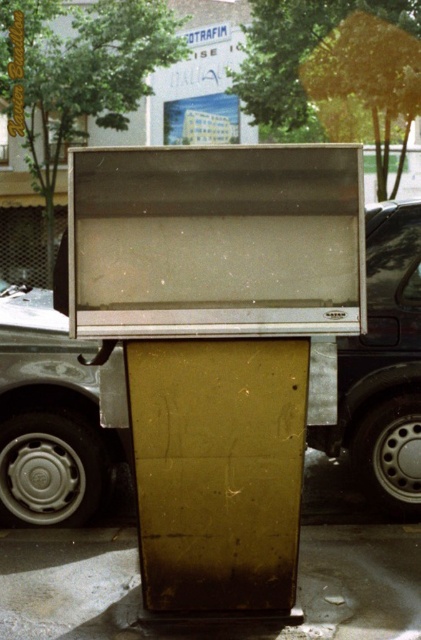
Which of these two, matte brown cardboard box at center or metallic silver car at center, stands taller?

With more height is metallic silver car at center.

Does matte brown cardboard box at center appear on the left side of metallic silver car at center?

Indeed, matte brown cardboard box at center is positioned on the left side of metallic silver car at center.

Find the location of a particular element. matte brown cardboard box at center is located at coordinates (218, 470).

Does matte brown cardboard box at center have a larger size compared to smooth concrete pavement at center?

Actually, matte brown cardboard box at center might be smaller than smooth concrete pavement at center.

Locate an element on the screen. The height and width of the screenshot is (640, 421). matte brown cardboard box at center is located at coordinates (218, 470).

Does metallic silver car at center have a smaller size compared to smooth concrete pavement at center?

Actually, metallic silver car at center might be larger than smooth concrete pavement at center.

Is point (53, 403) farther from viewer compared to point (349, 547)?

Yes.

Is point (373, 365) less distant than point (356, 612)?

That is False.

This screenshot has height=640, width=421. I want to click on metallic silver car at center, so click(383, 369).